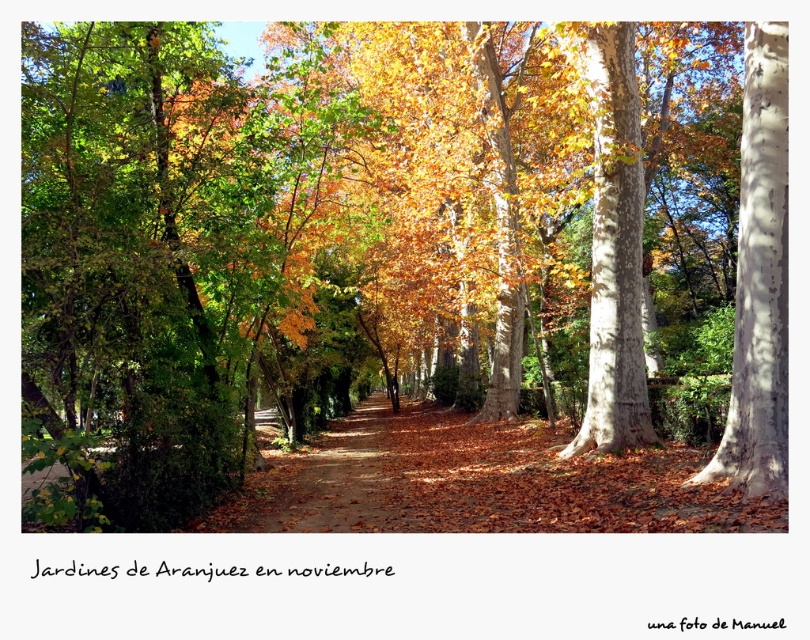
Who is shorter, smooth white bark at center or brown dirt path at center?

brown dirt path at center is shorter.

Between point (765, 224) and point (352, 442), which one is positioned in front?

Point (765, 224)

What are the coordinates of `smooth white bark at center` in the screenshot? It's located at (759, 280).

Can you confirm if smooth white bark at center is positioned to the right of smooth bark tree at center?

Correct, you'll find smooth white bark at center to the right of smooth bark tree at center.

Does point (761, 353) come in front of point (617, 76)?

That is True.

The width and height of the screenshot is (810, 640). What do you see at coordinates (759, 280) in the screenshot?
I see `smooth white bark at center` at bounding box center [759, 280].

The image size is (810, 640). I want to click on smooth white bark at center, so click(759, 280).

Who is shorter, smooth bark tree at center or brown dirt path at center?

With less height is brown dirt path at center.

The image size is (810, 640). Describe the element at coordinates (614, 252) in the screenshot. I see `smooth bark tree at center` at that location.

Locate an element on the screen. smooth bark tree at center is located at coordinates (614, 252).